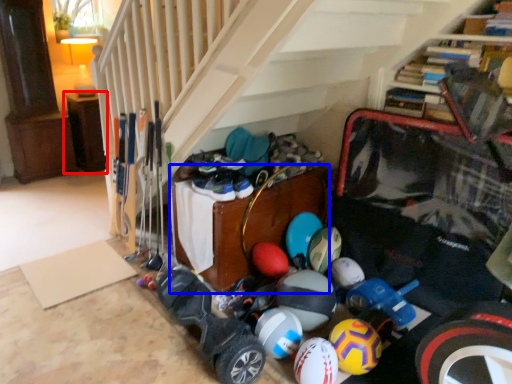
Question: Among these objects, which one is farthest to the camera, furniture (highlighted by a red box) or furniture (highlighted by a blue box)?

Choices:
 (A) furniture
 (B) furniture

Answer: (A)